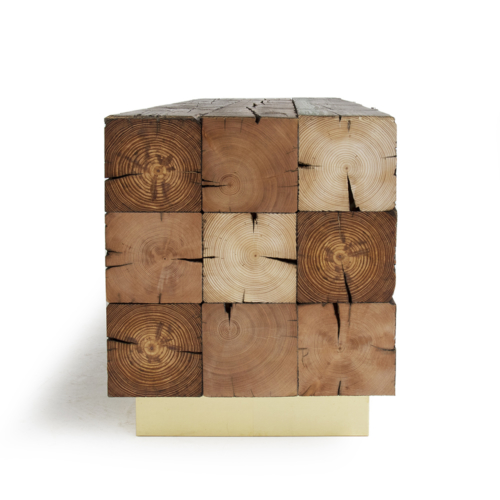
The image size is (500, 500). What are the coordinates of `wide plank` in the screenshot? It's located at (275, 414).